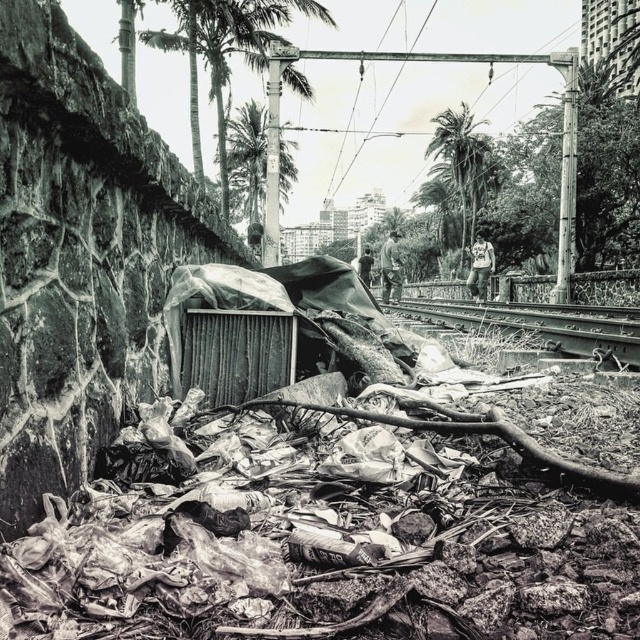
Is smooth metal train track at center below green leafy palm tree at upper right?

Yes.

Between point (634, 342) and point (440, 208), which one is positioned in front?

Point (634, 342) is in front.

Is point (579, 317) positioned behind point (438, 144)?

No.

The image size is (640, 640). Find the location of `smooth metal train track at center`. smooth metal train track at center is located at coordinates (544, 324).

Is point (189, 113) positioned before point (448, 134)?

No, it is behind (448, 134).

This screenshot has width=640, height=640. Identify the location of thick textured palm tree at upper center. (225, 52).

Image resolution: width=640 pixels, height=640 pixels. In order to click on thick textured palm tree at upper center in this screenshot , I will do `click(225, 52)`.

Between thick textured palm tree at upper center and smooth metal train track at center, which one has less height?

smooth metal train track at center is shorter.

Is thick textured palm tree at upper center thinner than smooth metal train track at center?

No.

Is point (225, 170) behind point (412, 308)?

Yes, point (225, 170) is farther from viewer.

You are a GUI agent. You are given a task and a screenshot of the screen. Output one action in this format:
    pyautogui.click(x=<x>, y=<y>)
    Task: Click on the thick textured palm tree at upper center
    This screenshot has width=640, height=640.
    Given the screenshot: What is the action you would take?
    pyautogui.click(x=225, y=52)